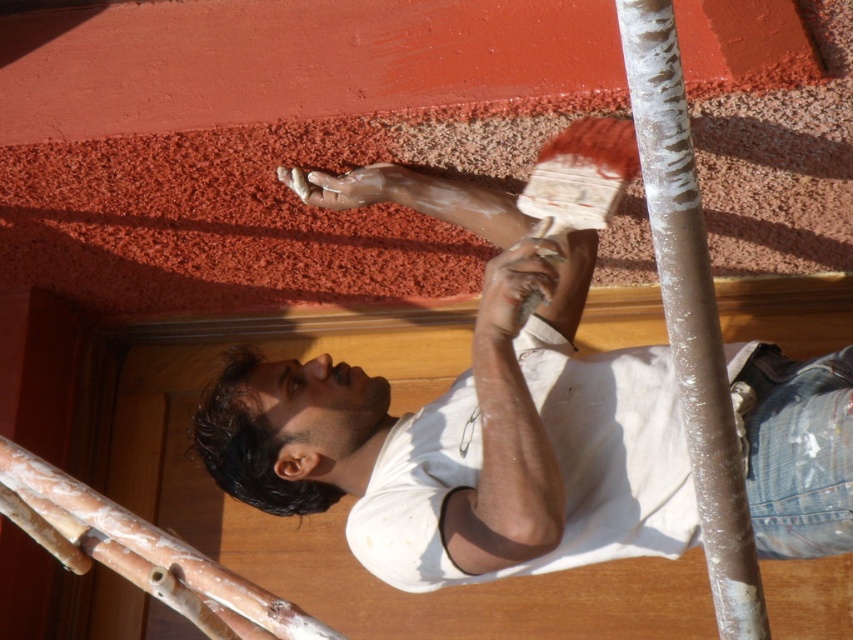
Question: Which of the following is the closest to the observer?

Choices:
 (A) (567, 564)
 (B) (613, 198)

Answer: (B)

Question: Considering the relative positions of white textured pole at right and white textured paintbrush at upper center in the image provided, where is white textured pole at right located with respect to white textured paintbrush at upper center?

Choices:
 (A) above
 (B) below

Answer: (B)

Question: Can you confirm if white matte shirt at center is positioned to the right of white textured pole at right?

Choices:
 (A) no
 (B) yes

Answer: (A)

Question: Which point is farther from the camera taking this photo?

Choices:
 (A) (521, 451)
 (B) (534, 177)
 (C) (718, 449)

Answer: (B)

Question: Does white matte shirt at center appear under white textured pole at right?

Choices:
 (A) no
 (B) yes

Answer: (B)

Question: Which point is closer to the camera taking this photo?

Choices:
 (A) (451, 451)
 (B) (607, 172)
 (C) (683, 108)

Answer: (C)